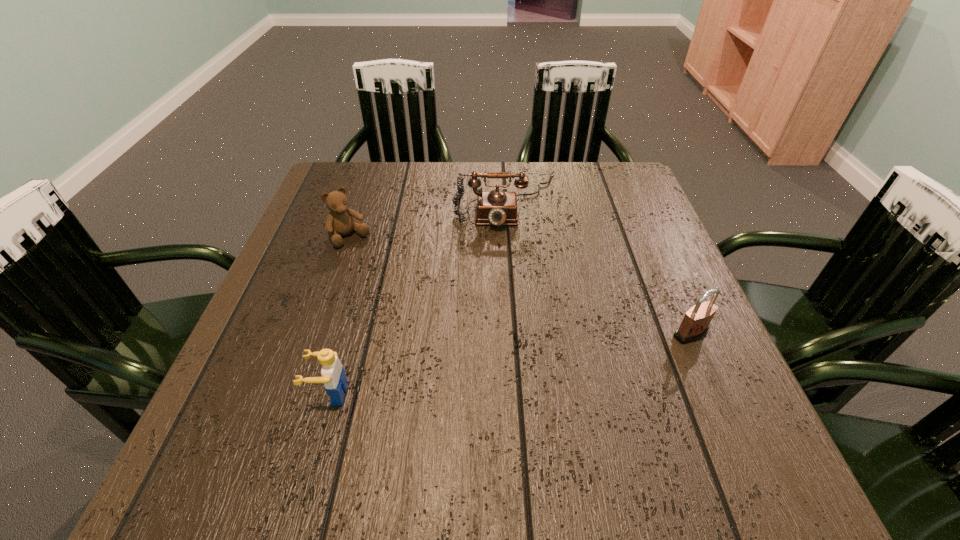
The width and height of the screenshot is (960, 540). Find the location of `free location that satisfies the following two spatial constraints: 1. on the front side of the Lego; 2. on the face of the teddy bear`. free location that satisfies the following two spatial constraints: 1. on the front side of the Lego; 2. on the face of the teddy bear is located at coordinates (297, 394).